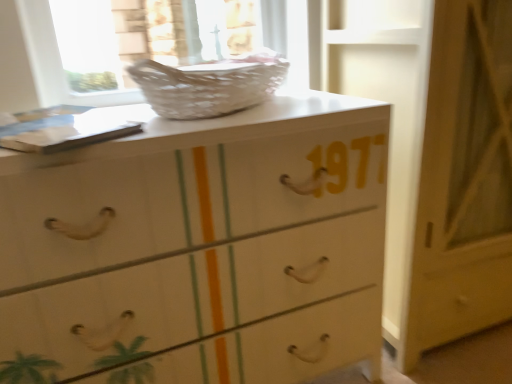
Question: Can you confirm if white glossy chest of drawers at center is wider than white glossy door at center?

Choices:
 (A) yes
 (B) no

Answer: (B)

Question: Is white glossy chest of drawers at center turned away from white glossy door at center?

Choices:
 (A) yes
 (B) no

Answer: (B)

Question: Is white glossy chest of drawers at center positioned far away from white glossy door at center?

Choices:
 (A) no
 (B) yes

Answer: (A)

Question: Can you confirm if white glossy chest of drawers at center is taller than white glossy door at center?

Choices:
 (A) no
 (B) yes

Answer: (A)

Question: Does white glossy chest of drawers at center have a lesser width compared to white glossy door at center?

Choices:
 (A) yes
 (B) no

Answer: (A)

Question: Can you confirm if white glossy chest of drawers at center is smaller than white glossy door at center?

Choices:
 (A) no
 (B) yes

Answer: (B)

Question: Could you tell me if white wicker basket at upper center is facing white glossy chest of drawers at center?

Choices:
 (A) yes
 (B) no

Answer: (B)

Question: Considering the relative sizes of white wicker basket at upper center and white glossy chest of drawers at center in the image provided, is white wicker basket at upper center taller than white glossy chest of drawers at center?

Choices:
 (A) no
 (B) yes

Answer: (A)

Question: Does white wicker basket at upper center have a lesser height compared to white glossy chest of drawers at center?

Choices:
 (A) yes
 (B) no

Answer: (A)

Question: Does white wicker basket at upper center have a lesser width compared to white glossy chest of drawers at center?

Choices:
 (A) yes
 (B) no

Answer: (A)

Question: Is the position of white wicker basket at upper center less distant than that of white glossy chest of drawers at center?

Choices:
 (A) no
 (B) yes

Answer: (A)

Question: From the image's perspective, is white wicker basket at upper center below white glossy chest of drawers at center?

Choices:
 (A) no
 (B) yes

Answer: (A)

Question: Is white glossy chest of drawers at center smaller than white wicker basket at upper center?

Choices:
 (A) yes
 (B) no

Answer: (B)